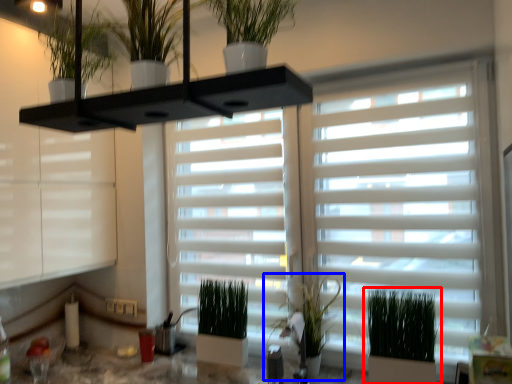
Question: Which object appears farthest to the camera in this image, houseplant (highlighted by a red box) or houseplant (highlighted by a blue box)?

Choices:
 (A) houseplant
 (B) houseplant

Answer: (B)